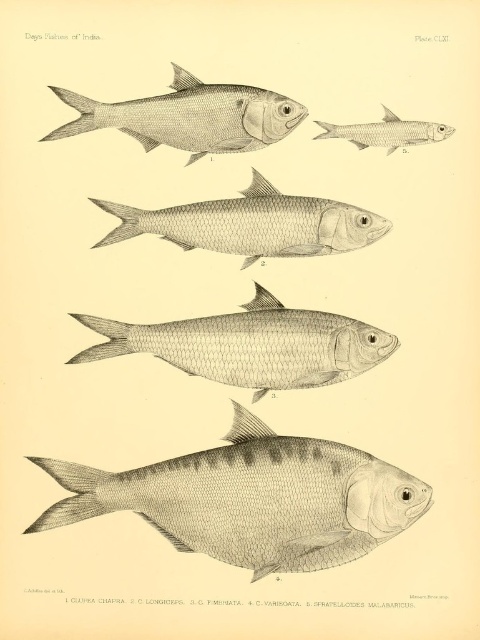
Who is higher up, grayish silver fish at center or gray metallic fish at upper center?

gray metallic fish at upper center is higher up.

Does grayish silver fish at center appear on the right side of gray metallic fish at upper center?

Incorrect, grayish silver fish at center is not on the right side of gray metallic fish at upper center.

The height and width of the screenshot is (640, 480). I want to click on grayish silver fish at center, so click(251, 346).

Consider the image. Is grayish silver fish at upper center shorter than gray metallic fish at upper center?

Incorrect, grayish silver fish at upper center's height does not fall short of gray metallic fish at upper center's.

Who is more forward, (57, 88) or (384, 108)?

Point (57, 88) is in front.

Identify the location of grayish silver fish at upper center. (248, 508).

Can you confirm if gray textured fish at bottom is positioned to the left of smooth silver fish at center?

Indeed, gray textured fish at bottom is positioned on the left side of smooth silver fish at center.

Measure the distance between gray textured fish at bottom and camera.

A distance of 3.30 feet exists between gray textured fish at bottom and camera.

Find the location of a particular element. The height and width of the screenshot is (640, 480). gray textured fish at bottom is located at coordinates (252, 499).